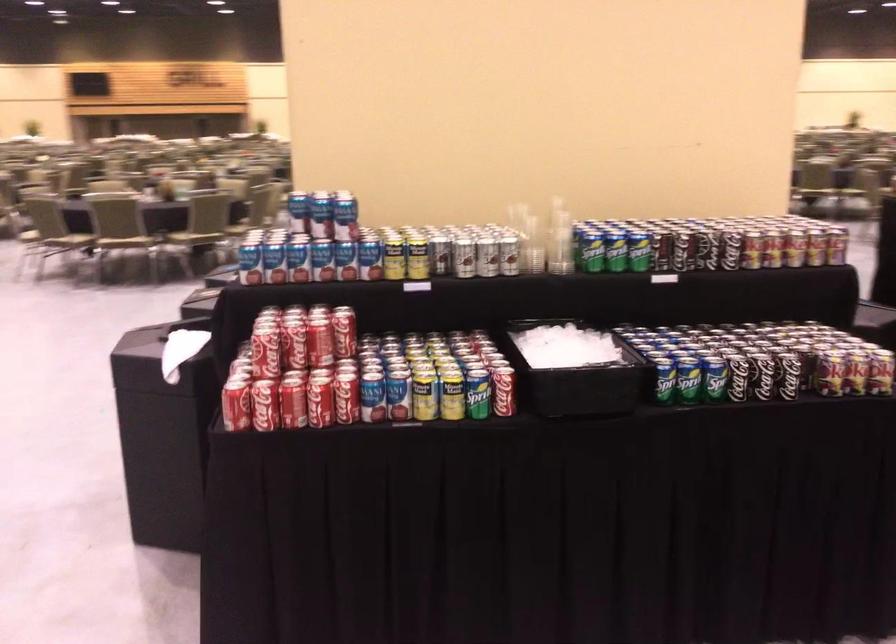
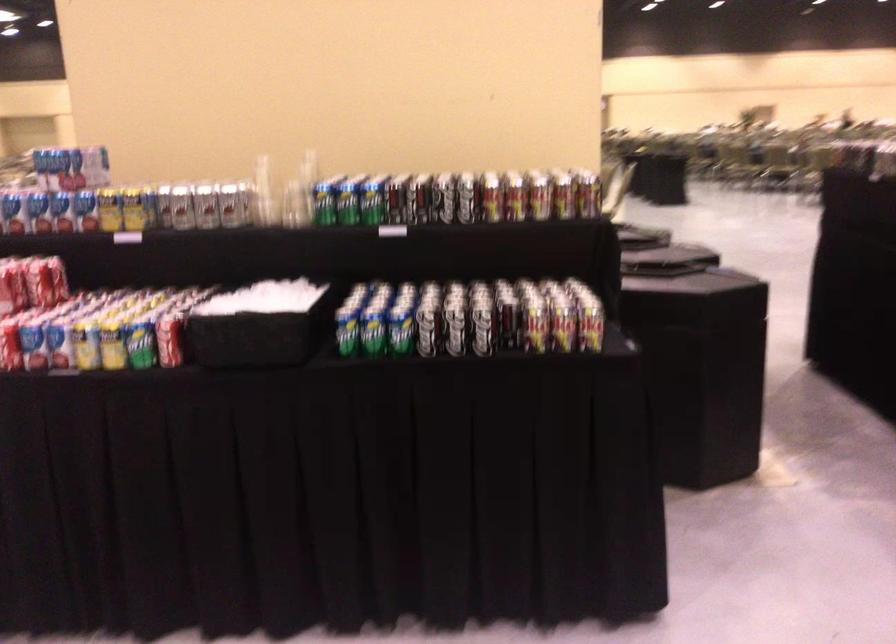
Question: Based on the continuous images, in which direction is the camera rotating? Reply with the corresponding letter.

Choices:
 (A) Left
 (B) Right
 (C) Up
 (D) Down

Answer: (A)